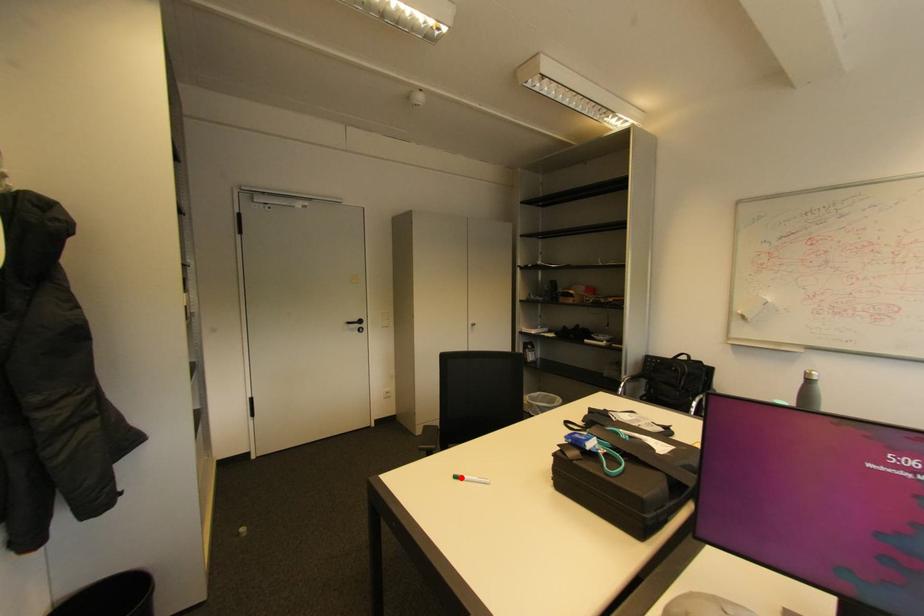
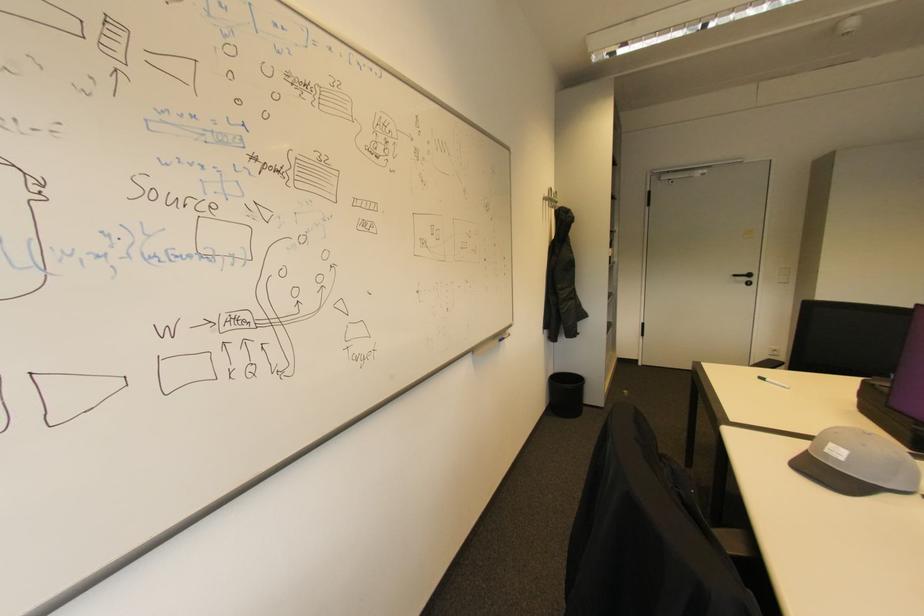
Question: I am providing you with two images of the same scene from different viewpoints. Image1 has a red point marked. In image2, the corresponding 3D location appears at what relative position? Reply with the corresponding letter.

Choices:
 (A) Closer
 (B) Farther

Answer: (B)